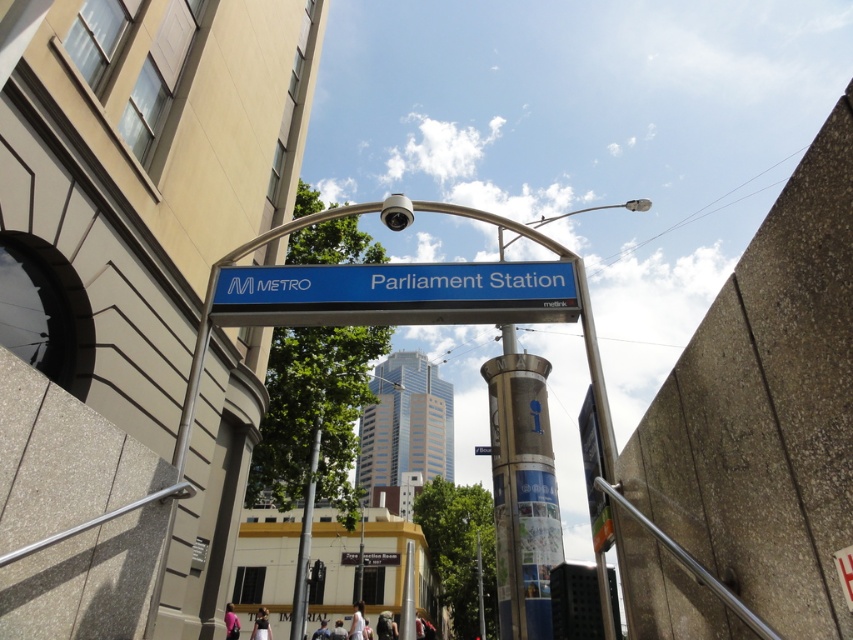
You are standing at the Parliament Station entrance and want to locate the blue metallic sign at center. According to the scene description, where exactly is the blue metallic sign positioned in the image?

The blue metallic sign at center is positioned at the point with coordinates 0.459 on the x axis and 0.464 on the y axis.

You are a delivery person approaching the Parliament Station entrance. You need to locate the blue metallic sign at center and the silver metallic pole at center. Which one is positioned to the right from your perspective?

The blue metallic sign at center is positioned to the right of the silver metallic pole at center.